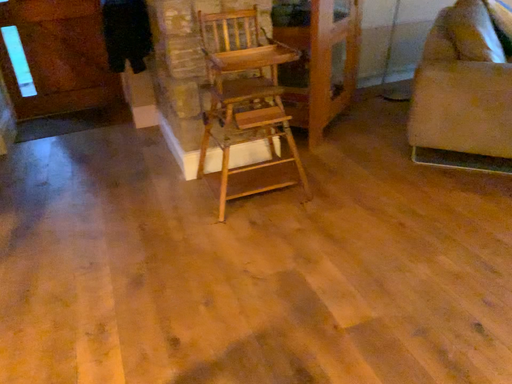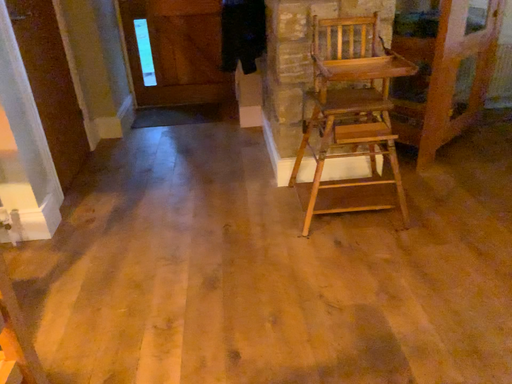
Question: Which way did the camera rotate in the video?

Choices:
 (A) rotated right
 (B) rotated left

Answer: (B)